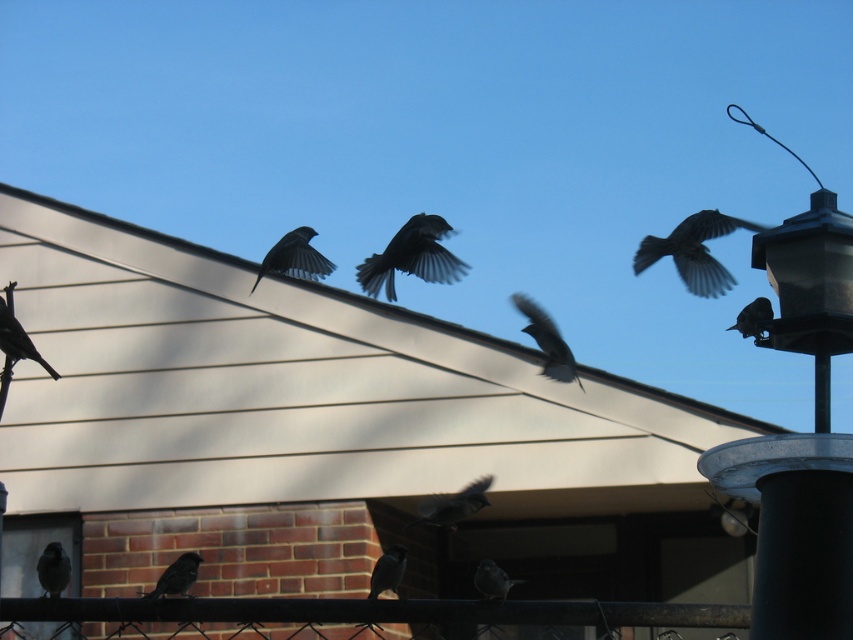
You are a drone operator trying to navigate between two points in the image. The first point is point (380,586) and the second is point (757,324). According to the scene, which point is closer to the building with beige siding and red brick?

Point (757,324) is closer to the building with beige siding and red brick because it is in front of point (380,586), which is behind it.

You are a birdwatcher observing the scene. You notice two distinct birds in the image. The first is the dark gray feathers at center, and the second is the silvery metallic bird at upper right. From your vantage point, which bird is positioned to the right of the other?

The silvery metallic bird at upper right is positioned to the right of the dark gray feathers at center.

You are standing at the base of the building and want to retrieve the dark gray feathers at upper center and the silvery gray bird at center. Which object is farther from you?

The dark gray feathers at upper center is 8.03 meters away from the silvery gray bird at center, so the dark gray feathers at upper center is farther from you.